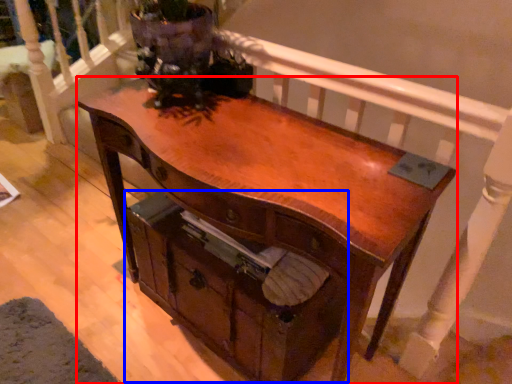
Question: Among these objects, which one is farthest to the camera, desk (highlighted by a red box) or drawer (highlighted by a blue box)?

Choices:
 (A) desk
 (B) drawer

Answer: (B)